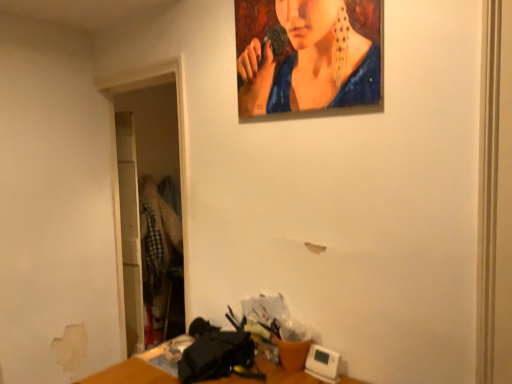
What do you see at coordinates (132, 373) in the screenshot?
I see `wooden table at lower center` at bounding box center [132, 373].

Locate an element on the screen. The height and width of the screenshot is (384, 512). wooden table at lower center is located at coordinates (132, 373).

What do you see at coordinates (310, 56) in the screenshot?
I see `oil painting portrait at upper center` at bounding box center [310, 56].

This screenshot has width=512, height=384. What are the coordinates of `oil painting portrait at upper center` in the screenshot? It's located at (310, 56).

Locate an element on the screen. The height and width of the screenshot is (384, 512). wooden table at lower center is located at coordinates (132, 373).

Does wooden table at lower center appear on the left side of oil painting portrait at upper center?

Yes.

Considering their positions, is wooden table at lower center located in front of or behind oil painting portrait at upper center?

wooden table at lower center is in front of oil painting portrait at upper center.

Does point (83, 380) appear closer or farther from the camera than point (361, 41)?

Clearly, point (83, 380) is more distant from the camera than point (361, 41).

From the image's perspective, who appears lower, wooden table at lower center or oil painting portrait at upper center?

wooden table at lower center appears lower in the image.

From a real-world perspective, which object rests below the other?

In real-world perspective, wooden table at lower center is lower.

Is wooden table at lower center thinner than oil painting portrait at upper center?

No.

Is wooden table at lower center taller or shorter than oil painting portrait at upper center?

wooden table at lower center is shorter than oil painting portrait at upper center.

Is wooden table at lower center smaller than oil painting portrait at upper center?

Actually, wooden table at lower center might be larger than oil painting portrait at upper center.

Is wooden table at lower center not inside oil painting portrait at upper center?

Yes, wooden table at lower center is located beyond the bounds of oil painting portrait at upper center.

Is wooden table at lower center positioned far away from oil painting portrait at upper center?

wooden table at lower center is far away from oil painting portrait at upper center.

Is oil painting portrait at upper center at the back of wooden table at lower center?

No, wooden table at lower center is not facing the opposite direction of oil painting portrait at upper center.

How different are the orientations of wooden table at lower center and oil painting portrait at upper center in degrees?

0.199 degrees.

Measure the distance from wooden table at lower center to oil painting portrait at upper center.

wooden table at lower center is 3.68 feet away from oil painting portrait at upper center.

In the image, there is a wooden table at lower center. Where is `person above it (from the image's perspective)`? The image size is (512, 384). person above it (from the image's perspective) is located at coordinates (310, 56).

Between oil painting portrait at upper center and wooden table at lower center, which one appears on the right side from the viewer's perspective?

From the viewer's perspective, oil painting portrait at upper center appears more on the right side.

Relative to wooden table at lower center, is oil painting portrait at upper center in front or behind?

Visually, oil painting portrait at upper center is located behind wooden table at lower center.

Considering the positions of points (378, 43) and (112, 377), is point (378, 43) farther from camera compared to point (112, 377)?

No, it is in front of (112, 377).

From the image's perspective, which is above, oil painting portrait at upper center or wooden table at lower center?

oil painting portrait at upper center, from the image's perspective.

From a real-world perspective, which object stands above the other?

oil painting portrait at upper center is physically above.

Does oil painting portrait at upper center have a greater width compared to wooden table at lower center?

Incorrect, the width of oil painting portrait at upper center does not surpass that of wooden table at lower center.

In the scene shown: From their relative heights in the image, would you say oil painting portrait at upper center is taller or shorter than wooden table at lower center?

Considering their sizes, oil painting portrait at upper center has more height than wooden table at lower center.

Which of these two, oil painting portrait at upper center or wooden table at lower center, is smaller?

oil painting portrait at upper center is smaller.

Is oil painting portrait at upper center not within wooden table at lower center?

That's correct, oil painting portrait at upper center is outside of wooden table at lower center.

Are oil painting portrait at upper center and wooden table at lower center making contact?

No, oil painting portrait at upper center is not with wooden table at lower center.

Is oil painting portrait at upper center oriented away from wooden table at lower center?

oil painting portrait at upper center is not turned away from wooden table at lower center.

How distant is oil painting portrait at upper center from wooden table at lower center?

oil painting portrait at upper center is 3.68 feet away from wooden table at lower center.

Locate an element on the screen. table below the oil painting portrait at upper center (from a real-world perspective) is located at coordinates (132, 373).

Locate an element on the screen. The width and height of the screenshot is (512, 384). table that appears on the left of oil painting portrait at upper center is located at coordinates (132, 373).

Find the location of `table in front of the oil painting portrait at upper center`. table in front of the oil painting portrait at upper center is located at coordinates (132, 373).